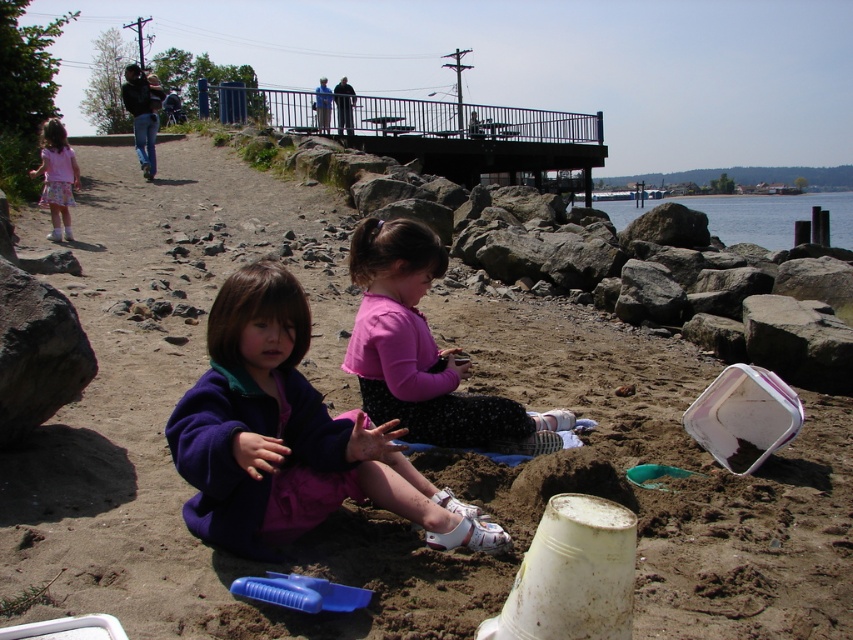
Based on the photo, who is higher up, purple fleece jacket at center or pink matte shirt at center?

pink matte shirt at center is higher up.

What do you see at coordinates (289, 436) in the screenshot?
I see `purple fleece jacket at center` at bounding box center [289, 436].

The image size is (853, 640). In order to click on purple fleece jacket at center in this screenshot , I will do `click(289, 436)`.

Is point (314, 429) less distant than point (770, 225)?

That is True.

Which of these two, purple fleece jacket at center or clear water at lower right, stands taller?

clear water at lower right

Who is more distant from viewer, (274, 417) or (711, 205)?

Positioned behind is point (711, 205).

I want to click on purple fleece jacket at center, so click(x=289, y=436).

Image resolution: width=853 pixels, height=640 pixels. Find the location of `pink matte shirt at center`. pink matte shirt at center is located at coordinates (424, 352).

Does point (508, 403) come behind point (782, 212)?

No, it is in front of (782, 212).

This screenshot has width=853, height=640. I want to click on pink matte shirt at center, so click(424, 352).

Locate an element on the screen. The height and width of the screenshot is (640, 853). pink matte shirt at center is located at coordinates (424, 352).